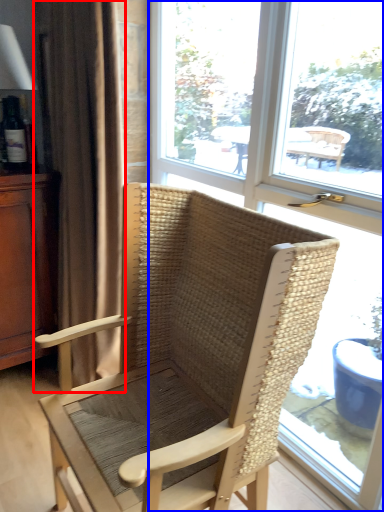
Question: Which object is further to the camera taking this photo, curtain (highlighted by a red box) or window (highlighted by a blue box)?

Choices:
 (A) curtain
 (B) window

Answer: (A)